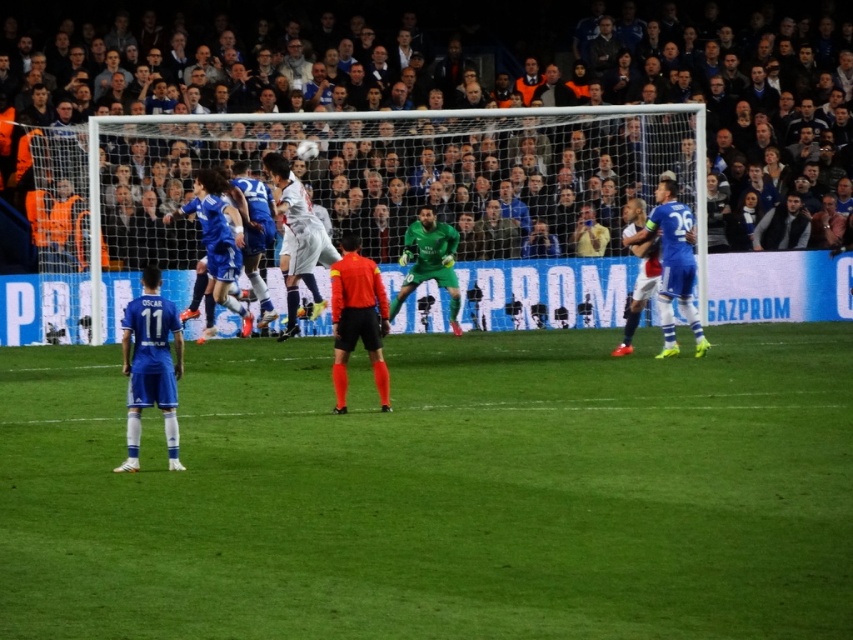
Question: Which point is closer to the camera?

Choices:
 (A) (173, 406)
 (B) (381, 396)
 (C) (670, 346)

Answer: (A)

Question: Which is nearer to the green grass football field at center?

Choices:
 (A) green matte/goalkeeper at center
 (B) blue jersey at right
 (C) orange jersey at center

Answer: (C)

Question: In this image, where is orange jersey at center located relative to green matte/goalkeeper at center?

Choices:
 (A) above
 (B) below

Answer: (B)

Question: Is orange jersey at center below green matte/goalkeeper at center?

Choices:
 (A) no
 (B) yes

Answer: (B)

Question: Which point is farther from the camera taking this photo?

Choices:
 (A) (86, 394)
 (B) (339, 330)

Answer: (A)

Question: Is blue jersey at lower left bigger than blue jersey at right?

Choices:
 (A) yes
 (B) no

Answer: (B)